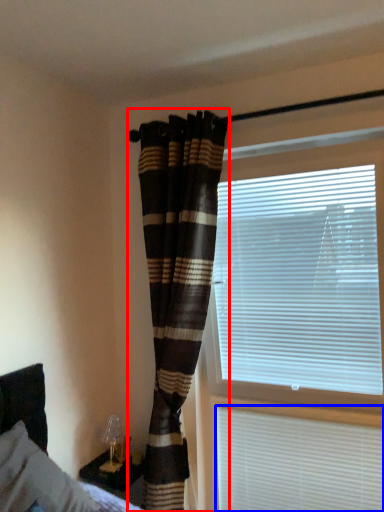
Question: Which object is closer to the camera taking this photo, curtain (highlighted by a red box) or window blind (highlighted by a blue box)?

Choices:
 (A) curtain
 (B) window blind

Answer: (A)